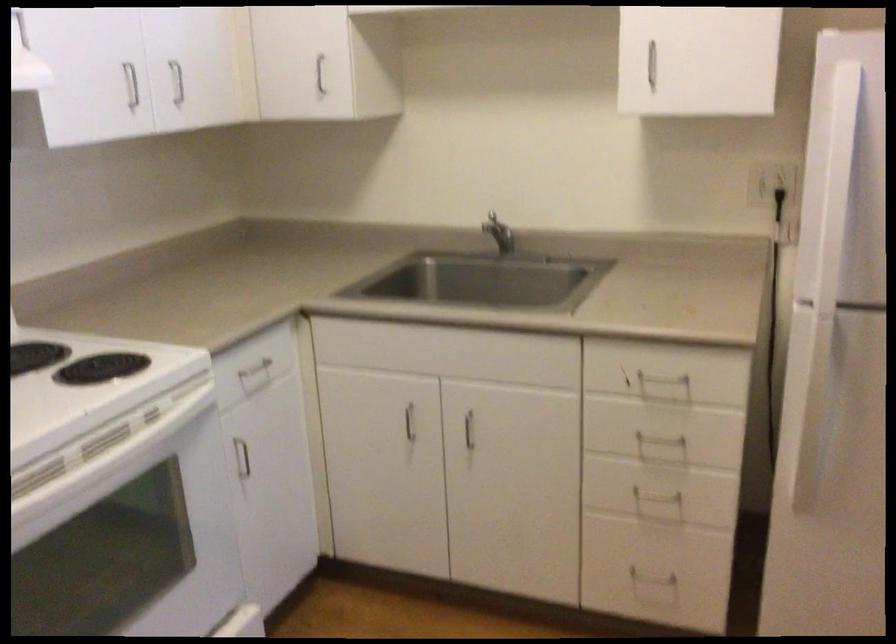
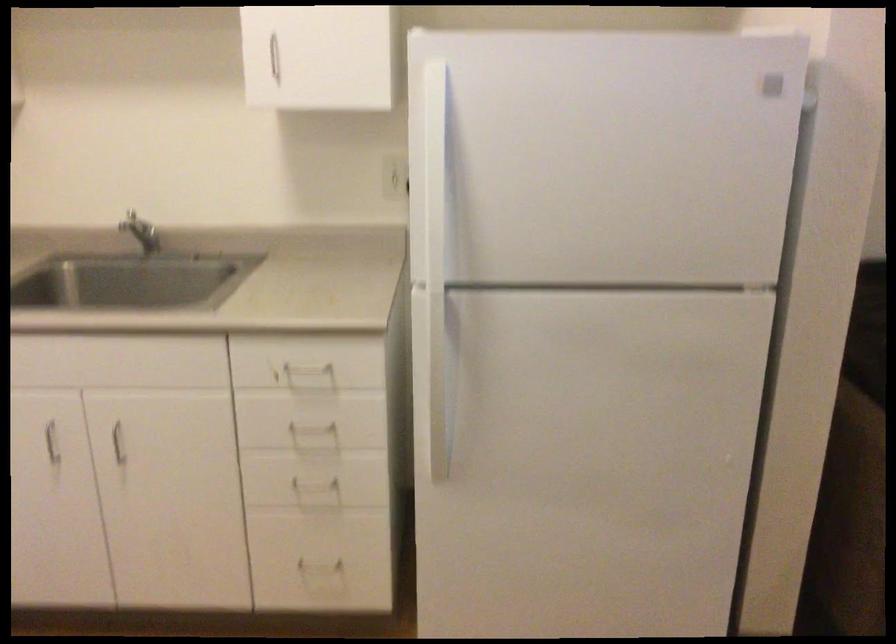
Question: I am providing you with two images of the same scene from different viewpoints. Which of the following objects are not visible in image2?

Choices:
 (A) white drawer handle
 (B) faucet handle
 (C) red round knob
 (D) black power plug

Answer: (D)